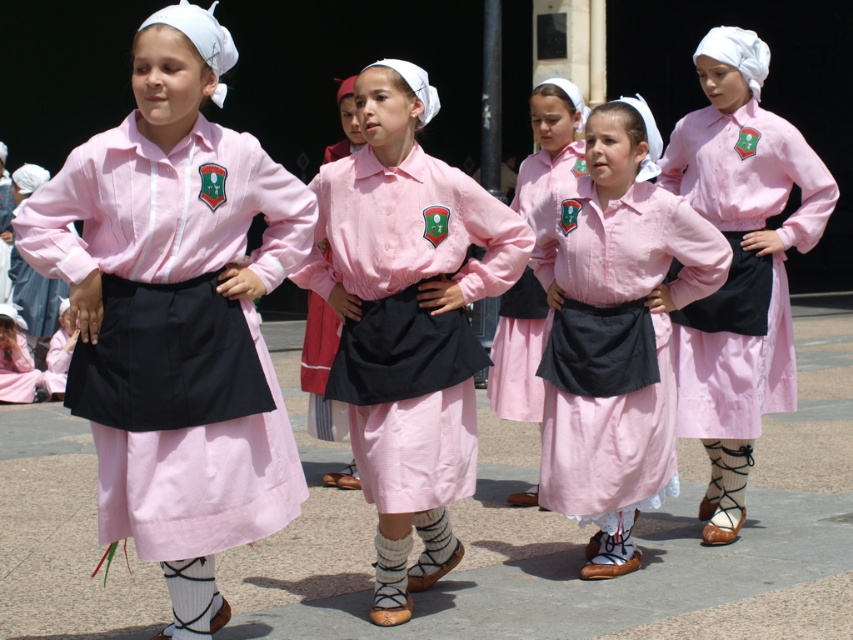
You are a photographer positioned at the back of the scene. You need to capture a photo where both the matte pink shirt at center and the pink cotton dress at center are visible. Given their heights, which one might appear closer to the top of the photo?

The matte pink shirt at center is taller than the pink cotton dress at center, so it will appear closer to the top of the photo.

Consider the image. Looking at the young girls in their traditional outfits, which clothing item is positioned to the left of the other between the pink cotton skirt at left and the pink cotton dress at center?

The pink cotton skirt at left is positioned to the left of the pink cotton dress at center.